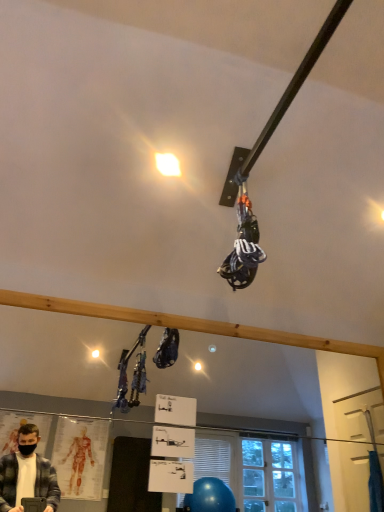
This screenshot has width=384, height=512. What do you see at coordinates (168, 164) in the screenshot?
I see `white glossy light bulb at upper center` at bounding box center [168, 164].

Where is `white glossy light bulb at upper center`? This screenshot has height=512, width=384. white glossy light bulb at upper center is located at coordinates click(168, 164).

This screenshot has height=512, width=384. I want to click on white glossy light bulb at upper center, so click(x=168, y=164).